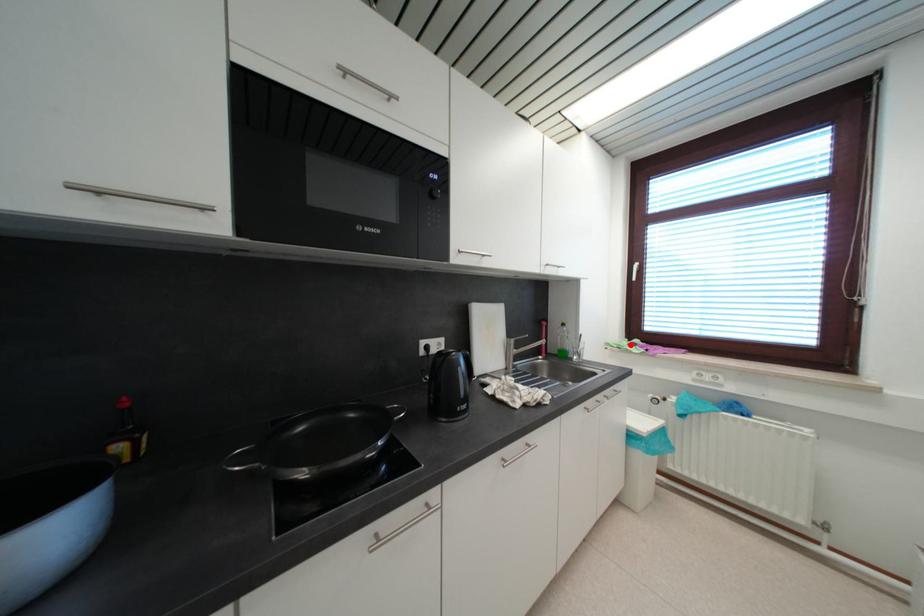
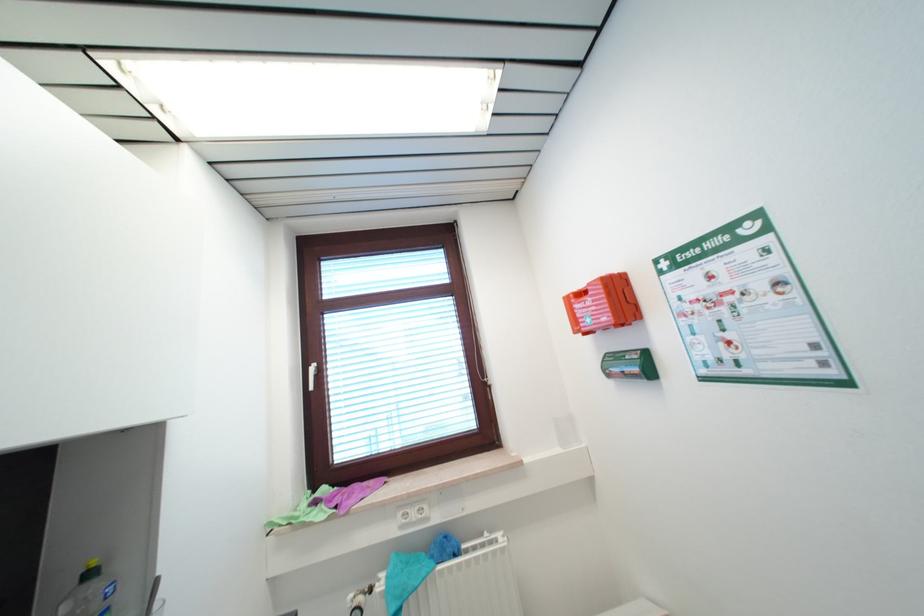
Question: A red point is marked in image1. In image2, is the corresponding 3D point closer to the camera or farther? Reply with the corresponding letter.

Choices:
 (A) The corresponding 3D point is closer.
 (B) The corresponding 3D point is farther.

Answer: (A)